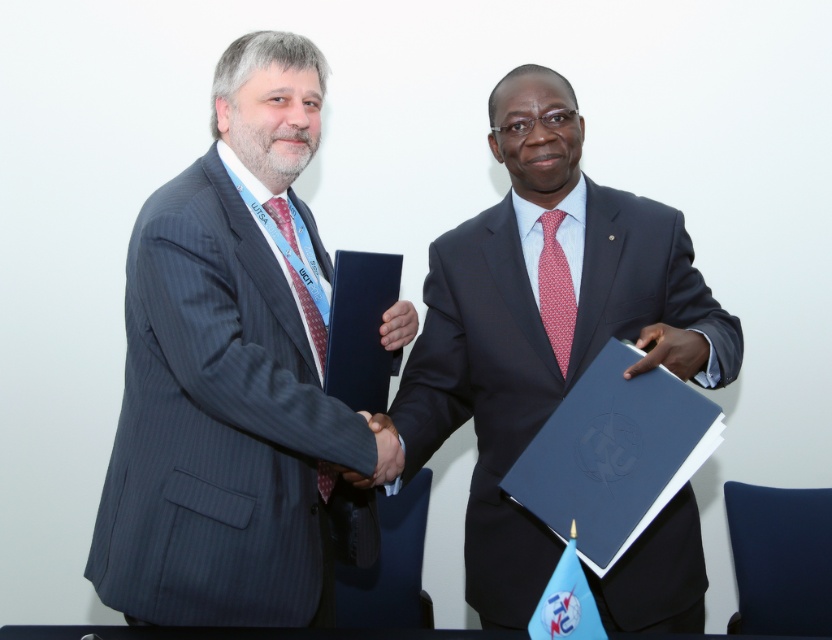
Question: Which point appears farthest from the camera in this image?

Choices:
 (A) (543, 220)
 (B) (691, 512)
 (C) (397, 321)

Answer: (A)

Question: Which of these objects is positioned farthest from the matte black suit at left?

Choices:
 (A) matte red tie at left
 (B) black smooth hand at center
 (C) red dotted fabric tie at center

Answer: (C)

Question: Can you confirm if matte black suit at left is positioned to the right of dark blue leather folder at center?

Choices:
 (A) no
 (B) yes

Answer: (A)

Question: Is dark blue leather folder at center above matte red tie at left?

Choices:
 (A) yes
 (B) no

Answer: (B)

Question: Which object appears closest to the camera in this image?

Choices:
 (A) black smooth hand at center
 (B) red dotted fabric tie at center

Answer: (A)

Question: Is dark blue leather folder at center wider than black smooth hand at center?

Choices:
 (A) no
 (B) yes

Answer: (B)